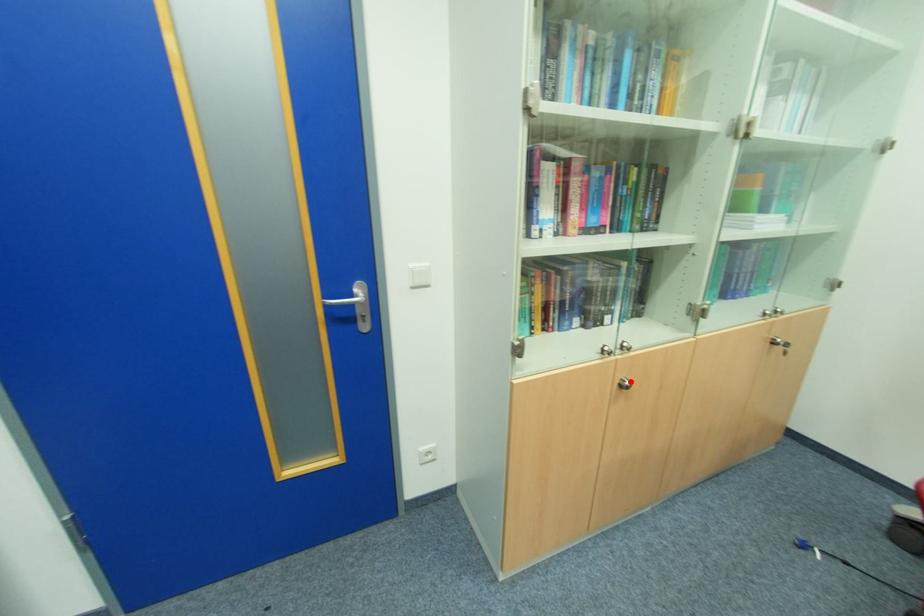
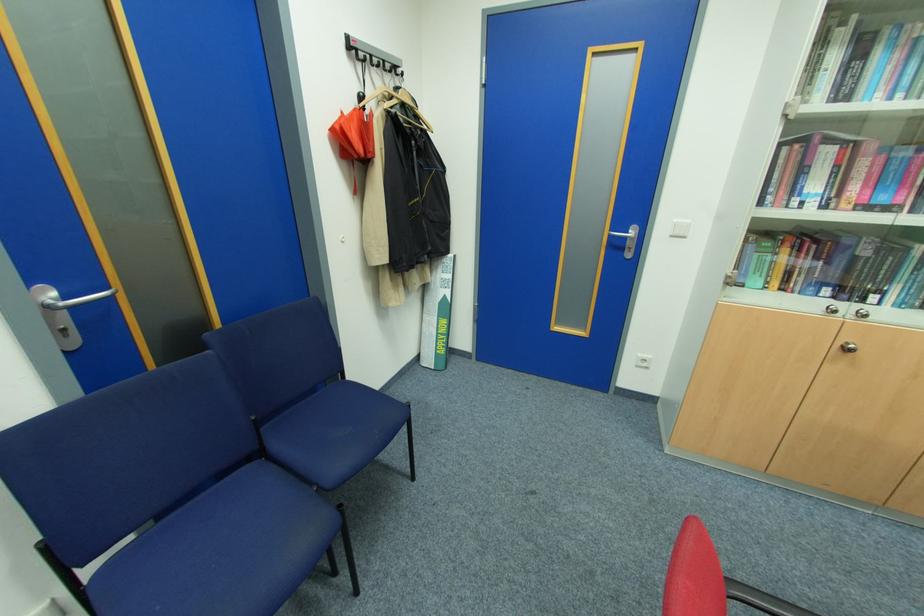
Where in the second image is the point corresponding to the highlighted location from the first image?

(856, 346)